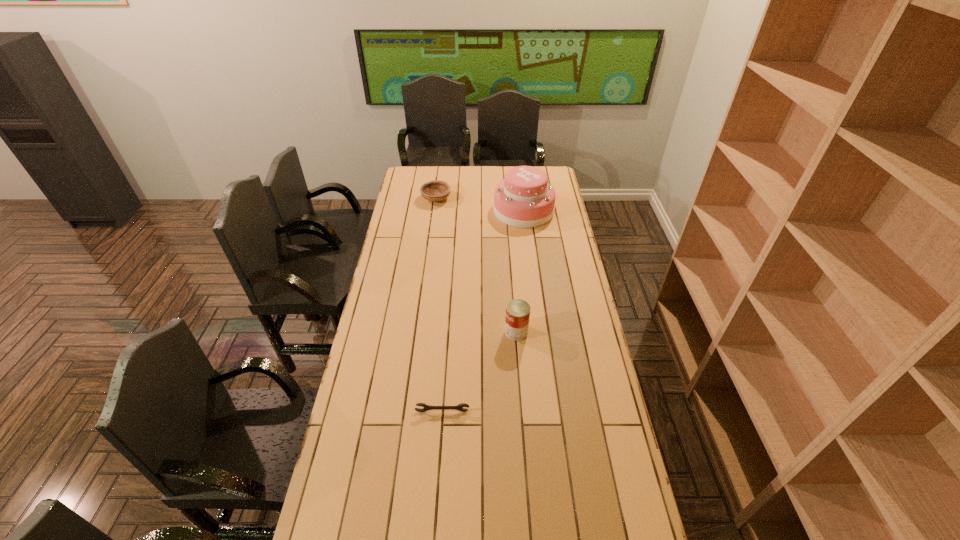
At what (x,y) coordinates should I click in order to perform the action: click on the tallest object. Please return your answer as a coordinate pair (x, y). This screenshot has width=960, height=540. Looking at the image, I should click on (524, 199).

I want to click on the second nearest object, so click(x=517, y=311).

Where is `can`? The width and height of the screenshot is (960, 540). can is located at coordinates pos(517,311).

This screenshot has height=540, width=960. In order to click on the third tallest object in this screenshot , I will do `click(436, 190)`.

Locate an element on the screen. the shortest object is located at coordinates (459, 407).

Image resolution: width=960 pixels, height=540 pixels. In order to click on the nearest object in this screenshot , I will do `click(459, 407)`.

The image size is (960, 540). I want to click on vacant area situated on the front of the tallest object, so click(x=529, y=255).

Identify the location of free spot located on the front label of the can. The width and height of the screenshot is (960, 540). (444, 332).

At what (x,y) coordinates should I click in order to perform the action: click on free spot located on the front label of the can. Please return your answer as a coordinate pair (x, y). Looking at the image, I should click on (485, 332).

Where is `vacant space situated on the front label of the can`? The image size is (960, 540). vacant space situated on the front label of the can is located at coordinates (452, 332).